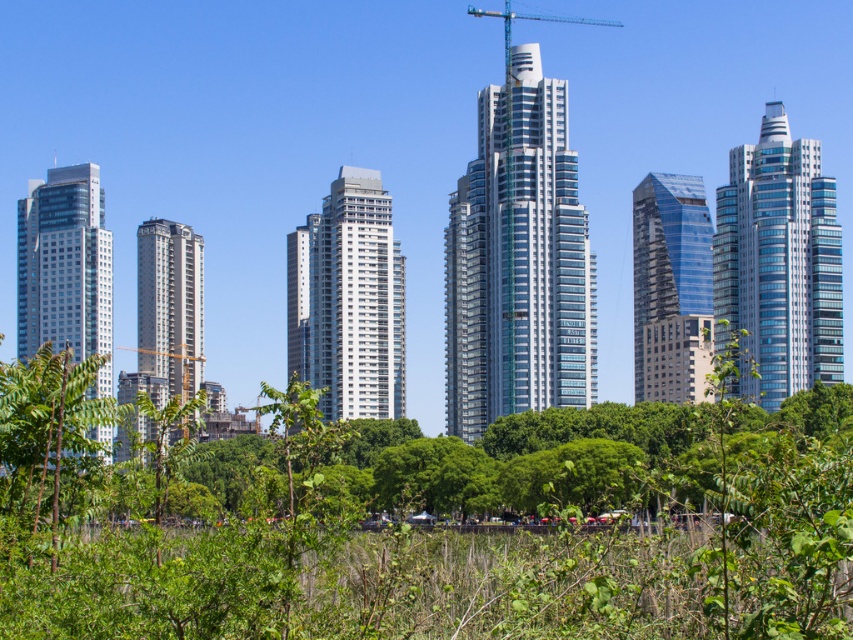
Is point (335, 621) more distant than point (403, 332)?

No, it is not.

Is green leafy tree at center positioned at the back of white glass building at center?

No, green leafy tree at center is closer to the viewer.

The image size is (853, 640). I want to click on green leafy tree at center, so click(426, 532).

Is green leafy tree at left above silver glass tower at center-left?

Incorrect, green leafy tree at left is not positioned above silver glass tower at center-left.

Who is more forward, (44, 460) or (171, 321)?

Positioned in front is point (44, 460).

Is point (86, 417) less distant than point (165, 374)?

Yes.

Locate an element on the screen. The height and width of the screenshot is (640, 853). green leafy tree at left is located at coordinates (44, 429).

Which of these two, glassy silver skyscraper at left or silver glass tower at center-left, stands taller?

With more height is glassy silver skyscraper at left.

Does glassy silver skyscraper at left have a lesser width compared to silver glass tower at center-left?

Incorrect, glassy silver skyscraper at left's width is not less than silver glass tower at center-left's.

Between point (100, 396) and point (142, 340), which one is positioned in front?

Positioned in front is point (100, 396).

This screenshot has height=640, width=853. In order to click on glassy silver skyscraper at left in this screenshot , I will do `click(65, 269)`.